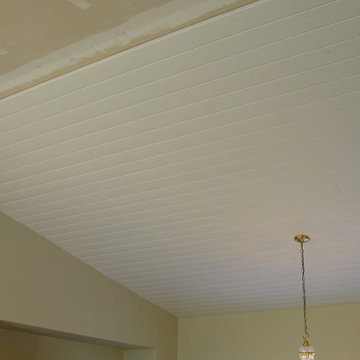
Locate an element on the screen. yellow wall is located at coordinates (213, 334).